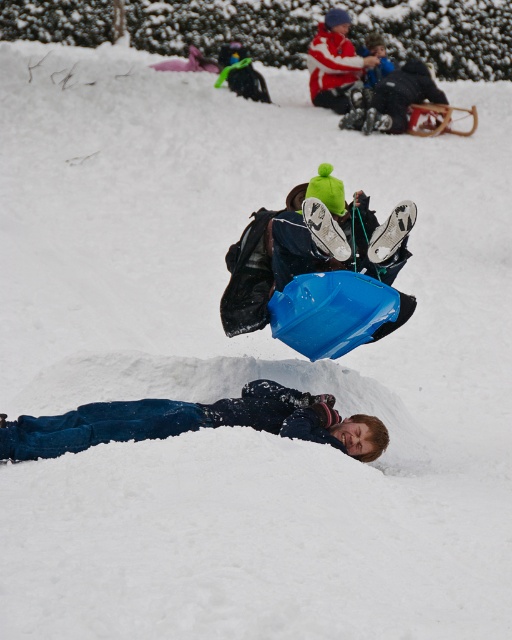
You are a photographer trying to capture a photo of the blue plastic sled at center and the dark blue denim pants at lower center. Can you clearly see both objects in the same frame without any obstruction?

The blue plastic sled at center is positioned over dark blue denim pants at lower center, so the sled is partially blocking the view of the dark blue denim pants at lower center. Therefore, you cannot clearly see both objects in the same frame without obstruction.

Looking at this image, you are trying to locate the blue plastic sled at center and the red and white striped sweater at upper center in the snowy scene. From the perspective of someone standing at the bottom of the hill, which object is closer to the right side?

The red and white striped sweater at upper center is closer to the right side because the blue plastic sled at center is positioned on the left side of it.

You are standing at the bottom of the hill and see the dark blue denim pants at lower center and the red and white striped sweater at upper center. Which person is closer to you?

The dark blue denim pants at lower center is closer to you because it is in front of the red and white striped sweater at upper center.